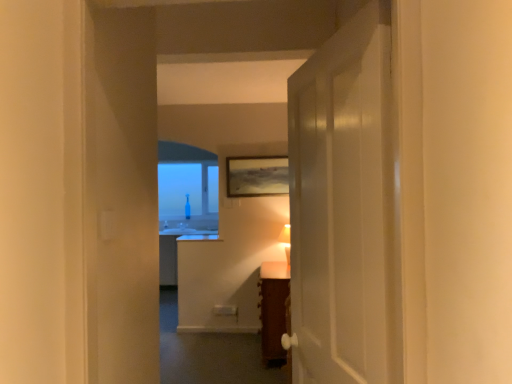
Measure the distance between point (354, 108) and camera.

Point (354, 108) is 4.08 feet away from camera.

Image resolution: width=512 pixels, height=384 pixels. What do you see at coordinates (188, 199) in the screenshot?
I see `transparent glass bottle at center` at bounding box center [188, 199].

Describe the element at coordinates (286, 243) in the screenshot. I see `matte white table lamp at center` at that location.

Identify the location of wooden cabinet at center. The width and height of the screenshot is (512, 384). (273, 309).

Based on the photo, which of these two, white glossy door at center or wooden cabinet at center, is smaller?

white glossy door at center.

Choose the correct answer: Is white glossy door at center inside wooden cabinet at center or outside it?

white glossy door at center cannot be found inside wooden cabinet at center.

From a real-world perspective, is white glossy door at center under wooden cabinet at center?

No, from a real-world perspective, white glossy door at center is not under wooden cabinet at center.

Considering the relative sizes of matte white table lamp at center and white glossy door at center in the image provided, is matte white table lamp at center smaller than white glossy door at center?

Indeed, matte white table lamp at center has a smaller size compared to white glossy door at center.

From a real-world perspective, is matte white table lamp at center below white glossy door at center?

Yes, from a real-world perspective, matte white table lamp at center is beneath white glossy door at center.

Relative to white glossy door at center, is matte white table lamp at center in front or behind?

matte white table lamp at center is behind white glossy door at center.

Are matte white table lamp at center and white glossy door at center located far from each other?

That's right, there is a large distance between matte white table lamp at center and white glossy door at center.

Choose the correct answer: Is transparent glass bottle at center inside wooden textured picture frame at center or outside it?

transparent glass bottle at center is spatially situated outside wooden textured picture frame at center.

Is transparent glass bottle at center positioned with its back to wooden textured picture frame at center?

No, wooden textured picture frame at center is not at the back of transparent glass bottle at center.

Between transparent glass bottle at center and wooden textured picture frame at center, which one has larger width?

transparent glass bottle at center is wider.

From the image's perspective, which one is positioned higher, transparent glass bottle at center or wooden textured picture frame at center?

wooden textured picture frame at center, from the image's perspective.

Visually, is transparent glass bottle at center positioned to the left or to the right of white glossy door at center?

transparent glass bottle at center is positioned on white glossy door at center's left side.

From a real-world perspective, which is physically below, transparent glass bottle at center or white glossy door at center?

white glossy door at center is physically lower.

Between transparent glass bottle at center and white glossy door at center, which one has larger size?

With larger size is transparent glass bottle at center.

Which is in front, point (181, 224) or point (344, 320)?

Positioned in front is point (344, 320).

From a real-world perspective, is white glossy door at center located beneath transparent glass bottle at center?

Correct, in the physical world, white glossy door at center is lower than transparent glass bottle at center.

From the image's perspective, relative to transparent glass bottle at center, is white glossy door at center above or below?

white glossy door at center is situated lower than transparent glass bottle at center in the image.

Does white glossy door at center appear on the left side of transparent glass bottle at center?

No.

From a real-world perspective, between transparent glass bottle at center and wooden cabinet at center, who is vertically higher?

transparent glass bottle at center, from a real-world perspective.

Is transparent glass bottle at center inside the boundaries of wooden cabinet at center, or outside?

transparent glass bottle at center is located beyond the bounds of wooden cabinet at center.

Which of these two, transparent glass bottle at center or wooden cabinet at center, is wider?

With larger width is wooden cabinet at center.

Considering their positions, is transparent glass bottle at center located in front of or behind wooden cabinet at center?

In the image, transparent glass bottle at center appears behind wooden cabinet at center.

Does matte white table lamp at center come behind transparent glass bottle at center?

No, matte white table lamp at center is closer to the camera.

Is matte white table lamp at center aimed at transparent glass bottle at center?

No.

In the image, is matte white table lamp at center on the left side or the right side of transparent glass bottle at center?

Based on their positions, matte white table lamp at center is located to the right of transparent glass bottle at center.

Where is `furniture behind the white glossy door at center`? The image size is (512, 384). furniture behind the white glossy door at center is located at coordinates (273, 309).

Where is `table lamp below the white glossy door at center (from the image's perspective)`? This screenshot has height=384, width=512. table lamp below the white glossy door at center (from the image's perspective) is located at coordinates (286, 243).

Looking at the image, which one is located closer to wooden cabinet at center, wooden textured picture frame at center or matte white table lamp at center?

Among the two, matte white table lamp at center is located nearer to wooden cabinet at center.

When comparing their distances from white glossy door at center, does wooden cabinet at center or wooden textured picture frame at center seem closer?

The object closer to white glossy door at center is wooden cabinet at center.

Looking at the image, which one is located further to transparent glass bottle at center, matte white table lamp at center or white glossy door at center?

white glossy door at center lies further to transparent glass bottle at center than the other object.

When comparing their distances from white glossy door at center, does transparent glass bottle at center or wooden textured picture frame at center seem closer?

wooden textured picture frame at center is positioned closer to the anchor white glossy door at center.

Looking at the image, which one is located further to matte white table lamp at center, wooden textured picture frame at center or white glossy door at center?

white glossy door at center.

From the image, which object appears to be nearer to matte white table lamp at center, wooden cabinet at center or wooden textured picture frame at center?

Among the two, wooden textured picture frame at center is located nearer to matte white table lamp at center.

Based on their spatial positions, is wooden cabinet at center or transparent glass bottle at center further from matte white table lamp at center?

transparent glass bottle at center.

Consider the image. Which object lies further to the anchor point transparent glass bottle at center, white glossy door at center or wooden textured picture frame at center?

white glossy door at center is positioned further to the anchor transparent glass bottle at center.

The image size is (512, 384). I want to click on furniture located between white glossy door at center and matte white table lamp at center in the depth direction, so click(273, 309).

Identify the location of table lamp between wooden cabinet at center and transparent glass bottle at center in the front-back direction. (286, 243).

Identify the location of table lamp between wooden textured picture frame at center and wooden cabinet at center in the up-down direction. (286, 243).

Find the location of a particular element. furniture positioned between white glossy door at center and wooden textured picture frame at center from near to far is located at coordinates (273, 309).